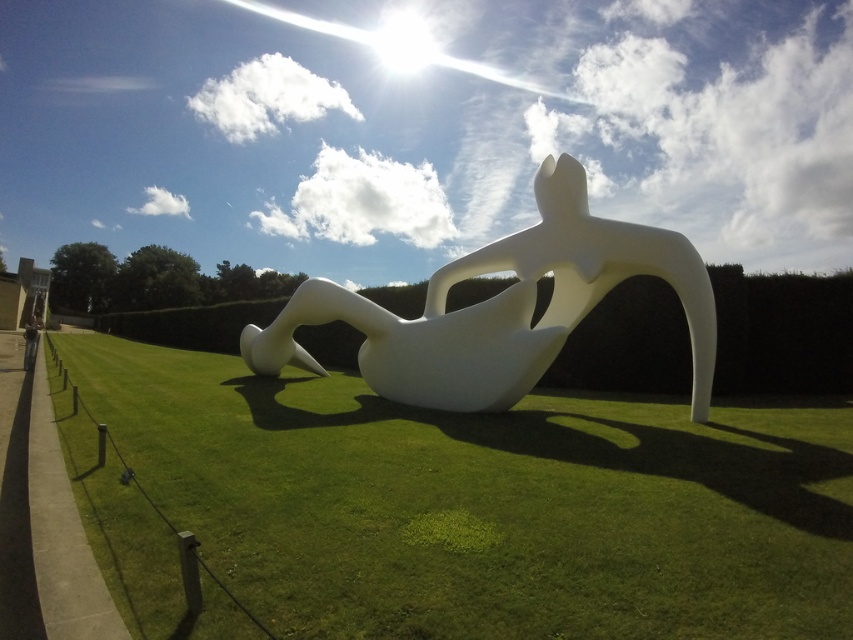
Does point (427, 422) lie in front of point (705, 374)?

Yes, point (427, 422) is closer to viewer.

This screenshot has width=853, height=640. What do you see at coordinates (486, 504) in the screenshot?
I see `green grass at center` at bounding box center [486, 504].

Find the location of a particular element. The width and height of the screenshot is (853, 640). green grass at center is located at coordinates (486, 504).